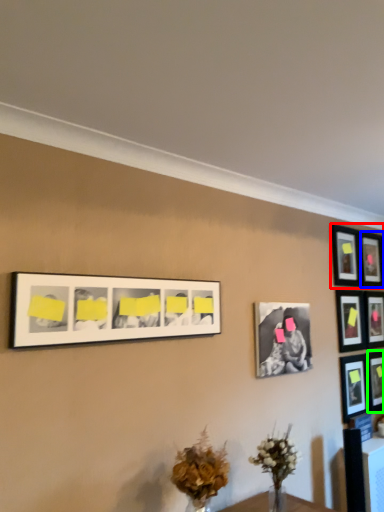
Question: Considering the real-world distances, which object is closest to picture frame (highlighted by a red box)? picture frame (highlighted by a blue box) or picture frame (highlighted by a green box).

Choices:
 (A) picture frame
 (B) picture frame

Answer: (A)